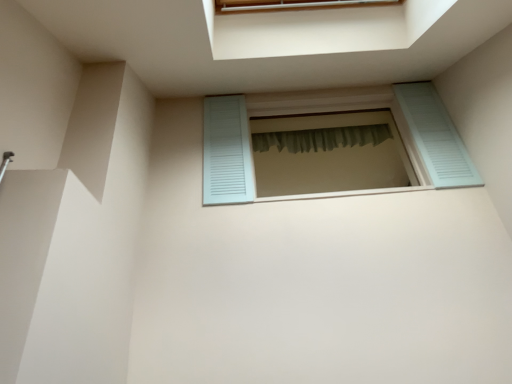
Question: Is light blue wooden window at center bigger than green sheer curtain at center?

Choices:
 (A) no
 (B) yes

Answer: (B)

Question: Does light blue wooden window at center have a lesser width compared to green sheer curtain at center?

Choices:
 (A) no
 (B) yes

Answer: (A)

Question: Can you confirm if light blue wooden window at center is shorter than green sheer curtain at center?

Choices:
 (A) yes
 (B) no

Answer: (B)

Question: Is light blue wooden window at center facing towards green sheer curtain at center?

Choices:
 (A) no
 (B) yes

Answer: (A)

Question: Is light blue wooden window at center outside green sheer curtain at center?

Choices:
 (A) yes
 (B) no

Answer: (A)

Question: Is light blue wooden window at center positioned with its back to green sheer curtain at center?

Choices:
 (A) yes
 (B) no

Answer: (A)

Question: From the image's perspective, would you say green sheer curtain at center is positioned over light blue wooden window at center?

Choices:
 (A) no
 (B) yes

Answer: (B)

Question: From a real-world perspective, is green sheer curtain at center positioned over light blue wooden window at center based on gravity?

Choices:
 (A) yes
 (B) no

Answer: (A)

Question: Does green sheer curtain at center have a lesser width compared to light blue wooden window at center?

Choices:
 (A) yes
 (B) no

Answer: (A)

Question: Can you confirm if green sheer curtain at center is bigger than light blue wooden window at center?

Choices:
 (A) no
 (B) yes

Answer: (A)

Question: Is green sheer curtain at center facing away from light blue wooden window at center?

Choices:
 (A) yes
 (B) no

Answer: (B)

Question: Can you confirm if green sheer curtain at center is shorter than light blue wooden window at center?

Choices:
 (A) yes
 (B) no

Answer: (A)

Question: From a real-world perspective, is green sheer curtain at center above or below light blue wooden window at center?

Choices:
 (A) above
 (B) below

Answer: (A)